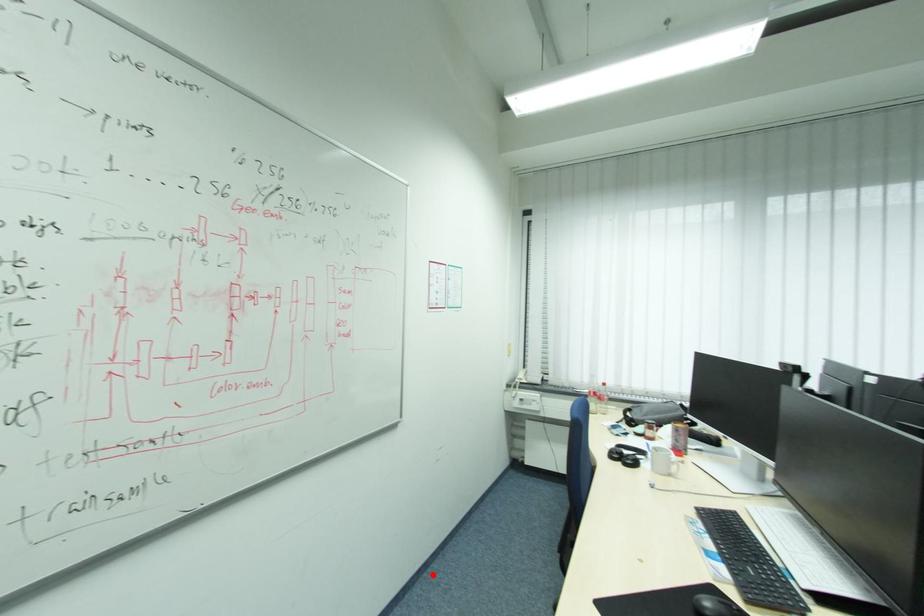
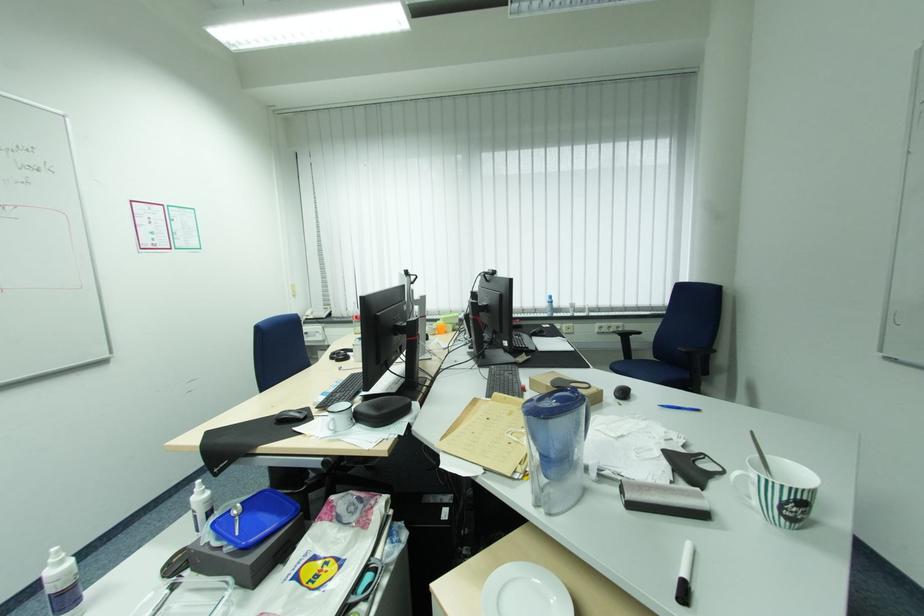
Question: I am providing you with two images of the same scene from different viewpoints. Image1 has a red point marked. In image2, the corresponding 3D location appears at what relative position? Reply with the corresponding letter.

Choices:
 (A) Closer
 (B) Farther

Answer: (A)